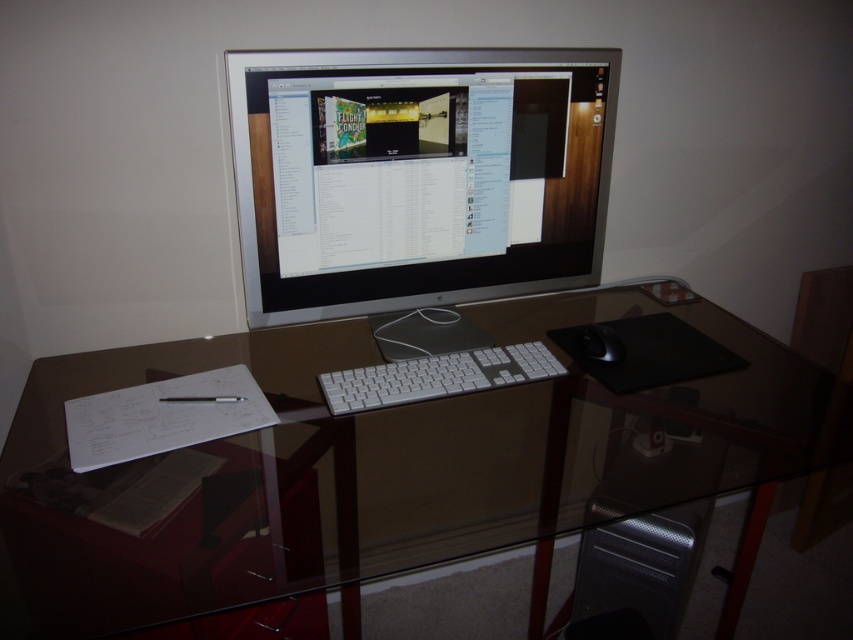
Question: Observing the image, what is the correct spatial positioning of transparent glass table at center in reference to satin silver monitor at center?

Choices:
 (A) above
 (B) below

Answer: (B)

Question: Which point is farther to the camera?

Choices:
 (A) white plastic keyboard at center
 (B) transparent glass table at center
 (C) silver textured computer tower at lower center
 (D) satin silver monitor at center

Answer: (C)

Question: Which of the following is the farthest from the observer?

Choices:
 (A) transparent glass table at center
 (B) silver textured computer tower at lower center

Answer: (B)

Question: Considering the relative positions of satin silver monitor at center and white plastic keyboard at center in the image provided, where is satin silver monitor at center located with respect to white plastic keyboard at center?

Choices:
 (A) left
 (B) right

Answer: (A)

Question: Considering the real-world distances, which object is closest to the transparent glass table at center?

Choices:
 (A) white plastic keyboard at center
 (B) satin silver monitor at center
 (C) black matte mouse at right
 (D) silver textured computer tower at lower center

Answer: (A)

Question: Is satin silver monitor at center further to camera compared to silver textured computer tower at lower center?

Choices:
 (A) no
 (B) yes

Answer: (A)